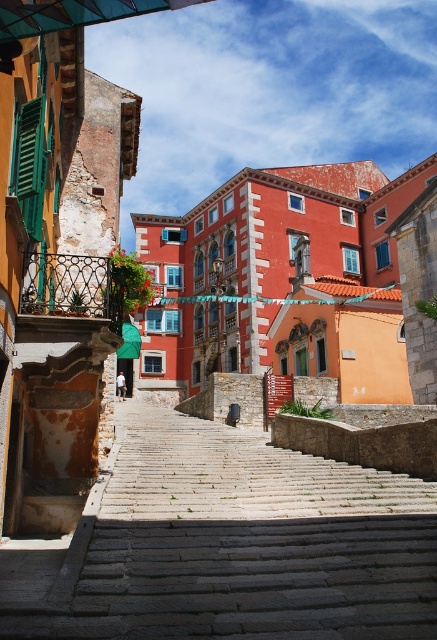
Question: Which object is closer to the camera taking this photo?

Choices:
 (A) red brick building at center
 (B) black wrought iron balustrade at left
 (C) green matte shutter at upper left

Answer: (C)

Question: Based on their relative distances, which object is farther from the black wrought iron balustrade at left?

Choices:
 (A) green matte shutter at upper left
 (B) red brick building at center

Answer: (B)

Question: Which object is the farthest from the green matte shutter at upper left?

Choices:
 (A) red brick building at center
 (B) black wrought iron balustrade at left

Answer: (A)

Question: Is red brick building at center above black wrought iron balustrade at left?

Choices:
 (A) no
 (B) yes

Answer: (B)

Question: Is red brick building at center below green matte shutter at upper left?

Choices:
 (A) no
 (B) yes

Answer: (A)

Question: Does black wrought iron balustrade at left have a greater width compared to green matte shutter at upper left?

Choices:
 (A) yes
 (B) no

Answer: (A)